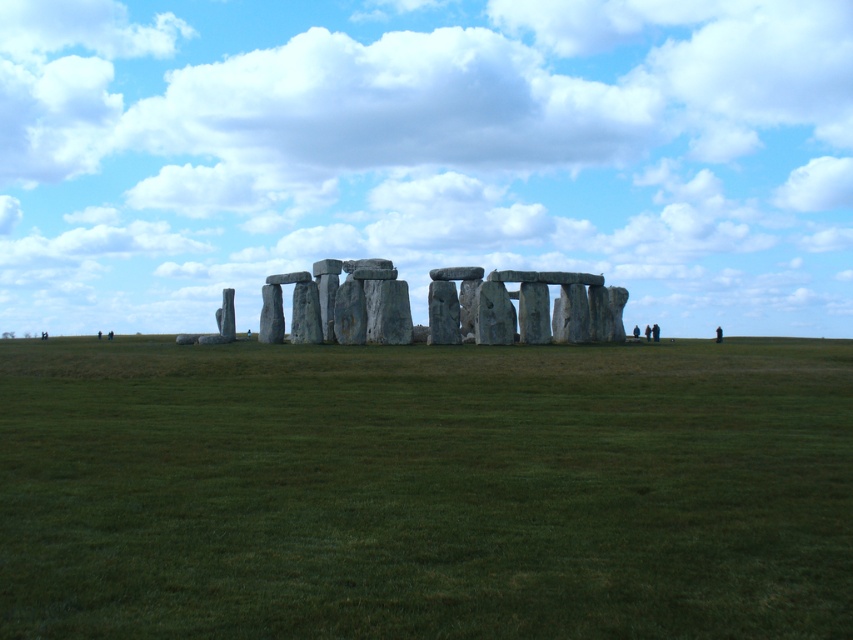
Does green grassy field at center have a lesser width compared to gray stone circle at center?

Incorrect, green grassy field at center's width is not less than gray stone circle at center's.

Who is more distant from viewer, (16, 428) or (520, 330)?

The point (520, 330) is more distant.

This screenshot has height=640, width=853. I want to click on green grassy field at center, so click(x=425, y=490).